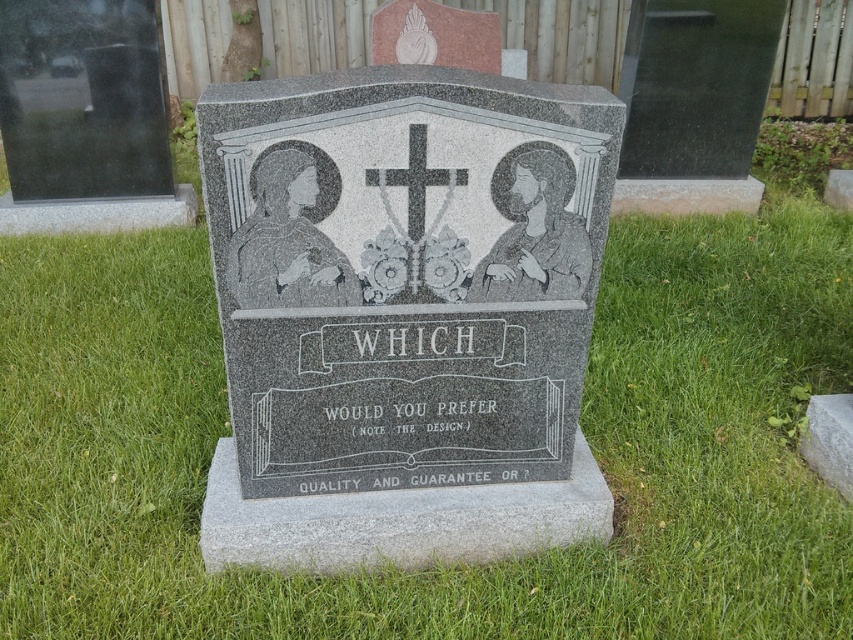
Is green grass at center above black granite cross at center?

No.

Does green grass at center have a larger size compared to black granite cross at center?

Yes.

The width and height of the screenshot is (853, 640). Find the location of `green grass at center`. green grass at center is located at coordinates (434, 566).

Is green grass at center wider than granite monument at center?

Correct, the width of green grass at center exceeds that of granite monument at center.

Where is `green grass at center`? This screenshot has height=640, width=853. green grass at center is located at coordinates (434, 566).

I want to click on green grass at center, so click(434, 566).

In the scene shown: Is granite monument at center to the right of black granite cross at center from the viewer's perspective?

Incorrect, granite monument at center is not on the right side of black granite cross at center.

Is granite monument at center below black granite cross at center?

Yes, granite monument at center is below black granite cross at center.

The height and width of the screenshot is (640, 853). What are the coordinates of `granite monument at center` in the screenshot? It's located at (403, 314).

The height and width of the screenshot is (640, 853). Find the location of `granite monument at center`. granite monument at center is located at coordinates (403, 314).